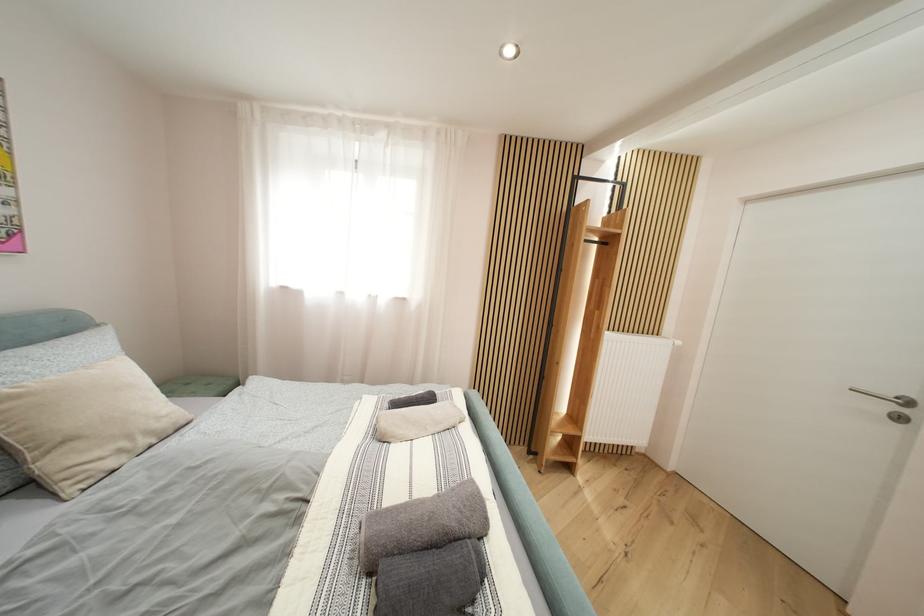
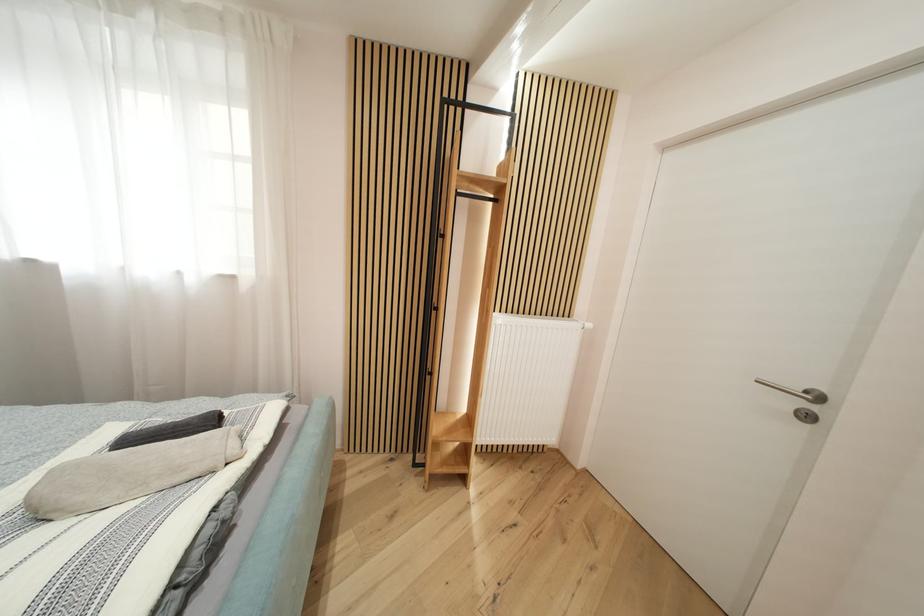
Question: The images are taken continuously from a first-person perspective. In which direction is your viewpoint rotating?

Choices:
 (A) Left
 (B) Right
 (C) Up
 (D) Down

Answer: (B)